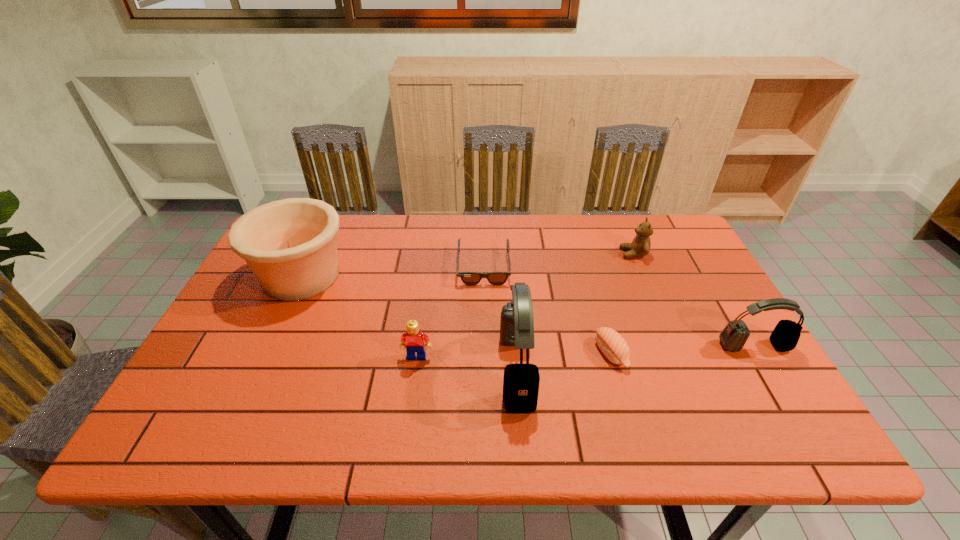
Find the location of a particular element. the second object from left to right is located at coordinates (413, 340).

Identify the location of vacant position located 0.270m on the headband of the left headset. (384, 369).

Where is `blank space located 0.050m on the headband of the left headset`? blank space located 0.050m on the headband of the left headset is located at coordinates (479, 369).

You are a GUI agent. You are given a task and a screenshot of the screen. Output one action in this format:
    pyautogui.click(x=<x>, y=<y>)
    Task: Click on the vacant region located on the headband of the left headset
    
    Given the screenshot: What is the action you would take?
    pyautogui.click(x=393, y=369)

You are a GUI agent. You are given a task and a screenshot of the screen. Output one action in this format:
    pyautogui.click(x=<x>, y=<y>)
    Task: Click on the vacant space located on the headband of the right headset
    This screenshot has height=540, width=960.
    Given the screenshot: What is the action you would take?
    pyautogui.click(x=782, y=393)

Where is `free region located on the front-facing side of the teddy bear`? The image size is (960, 540). free region located on the front-facing side of the teddy bear is located at coordinates (496, 253).

Identify the location of vacant space located 0.090m on the front-facing side of the teddy bear. This screenshot has width=960, height=540. (591, 253).

Find the location of `vacant space located on the front-facing side of the teddy bear`. vacant space located on the front-facing side of the teddy bear is located at coordinates pyautogui.click(x=604, y=253).

At what (x,y) coordinates should I click in order to perform the action: click on free point located on the right of the second tallest object. Please return your answer as a coordinate pair (x, y). Looking at the image, I should click on (479, 276).

Find the location of a particular element. vacant point located on the temples of the shortest object is located at coordinates (485, 372).